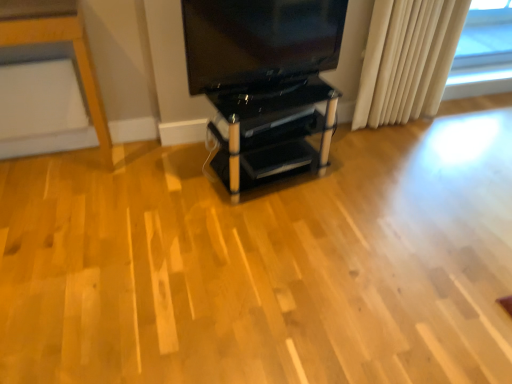
This screenshot has height=384, width=512. What are the coordinates of `matte black tv at upper center` in the screenshot? It's located at (259, 42).

This screenshot has width=512, height=384. In order to click on black glass shelving unit at center in this screenshot , I will do `click(272, 132)`.

The width and height of the screenshot is (512, 384). What do you see at coordinates (407, 59) in the screenshot?
I see `white fabric curtain at right` at bounding box center [407, 59].

Image resolution: width=512 pixels, height=384 pixels. Find the location of `matte black tv at upper center`. matte black tv at upper center is located at coordinates (259, 42).

Can you tell me how much black glass shelving unit at center and white fabric curtain at right differ in facing direction?

The facing directions of black glass shelving unit at center and white fabric curtain at right are 8.32 degrees apart.

From a real-world perspective, is black glass shelving unit at center positioned above or below white fabric curtain at right?

black glass shelving unit at center is situated lower than white fabric curtain at right in the real world.

Could you tell me if black glass shelving unit at center is facing white fabric curtain at right?

No, black glass shelving unit at center is not aimed at white fabric curtain at right.

Based on the photo, is black glass shelving unit at center completely or partially outside of white fabric curtain at right?

Yes, black glass shelving unit at center is not within white fabric curtain at right.

Which is behind, matte black tv at upper center or black glass shelving unit at center?

Positioned behind is black glass shelving unit at center.

Is matte black tv at upper center turned away from black glass shelving unit at center?

That's not correct — matte black tv at upper center is not looking away from black glass shelving unit at center.

Are matte black tv at upper center and black glass shelving unit at center beside each other?

There is a gap between matte black tv at upper center and black glass shelving unit at center.

From the picture: Between matte black tv at upper center and black glass shelving unit at center, which one appears on the left side from the viewer's perspective?

From the viewer's perspective, matte black tv at upper center appears more on the left side.

Would you consider black glass shelving unit at center to be distant from matte black tv at upper center?

A: black glass shelving unit at center is near matte black tv at upper center, not far away.

Does black glass shelving unit at center have a smaller size compared to matte black tv at upper center?

No.

Can you confirm if black glass shelving unit at center is thinner than matte black tv at upper center?

No, black glass shelving unit at center is not thinner than matte black tv at upper center.

Could you tell me if black glass shelving unit at center is facing matte black tv at upper center?

No, black glass shelving unit at center is not facing towards matte black tv at upper center.

From a real-world perspective, is white fabric curtain at right physically located above or below black glass shelving unit at center?

In terms of real-world spatial position, white fabric curtain at right is above black glass shelving unit at center.

Is white fabric curtain at right oriented away from black glass shelving unit at center?

white fabric curtain at right does not have its back to black glass shelving unit at center.

In the scene shown: Can you tell me how much white fabric curtain at right and black glass shelving unit at center differ in facing direction?

8.32 degrees.

From the image's perspective, is white fabric curtain at right under black glass shelving unit at center?

No, from the image's perspective, white fabric curtain at right is not below black glass shelving unit at center.

Does matte black tv at upper center have a lesser width compared to white fabric curtain at right?

Indeed, matte black tv at upper center has a lesser width compared to white fabric curtain at right.

Between matte black tv at upper center and white fabric curtain at right, which one has larger size?

white fabric curtain at right is bigger.

Is matte black tv at upper center in front of or behind white fabric curtain at right in the image?

In the image, matte black tv at upper center appears in front of white fabric curtain at right.

Is white fabric curtain at right placed right next to matte black tv at upper center?

No, white fabric curtain at right is not next to matte black tv at upper center.

Is white fabric curtain at right wider than matte black tv at upper center?

Yes.

Between white fabric curtain at right and matte black tv at upper center, which one has smaller size?

matte black tv at upper center.

At what (x,y) coordinates should I click in order to perform the action: click on furniture in front of the white fabric curtain at right. Please return your answer as a coordinate pair (x, y). This screenshot has width=512, height=384. Looking at the image, I should click on (272, 132).

The image size is (512, 384). I want to click on furniture lying behind the matte black tv at upper center, so click(x=272, y=132).

Based on their spatial positions, is black glass shelving unit at center or white fabric curtain at right closer to matte black tv at upper center?

The object closer to matte black tv at upper center is black glass shelving unit at center.

From the image, which object appears to be nearer to black glass shelving unit at center, white fabric curtain at right or matte black tv at upper center?

Based on the image, matte black tv at upper center appears to be nearer to black glass shelving unit at center.

Estimate the real-world distances between objects in this image. Which object is further from matte black tv at upper center, white fabric curtain at right or black glass shelving unit at center?

Among the two, white fabric curtain at right is located further to matte black tv at upper center.

From the picture: Based on their spatial positions, is black glass shelving unit at center or matte black tv at upper center closer to white fabric curtain at right?

matte black tv at upper center lies closer to white fabric curtain at right than the other object.

Based on their spatial positions, is matte black tv at upper center or black glass shelving unit at center closer to white fabric curtain at right?

matte black tv at upper center lies closer to white fabric curtain at right than the other object.

From the image, which object appears to be farther from black glass shelving unit at center, matte black tv at upper center or white fabric curtain at right?

Among the two, white fabric curtain at right is located further to black glass shelving unit at center.

Identify the location of furniture between matte black tv at upper center and white fabric curtain at right from left to right. [272, 132].